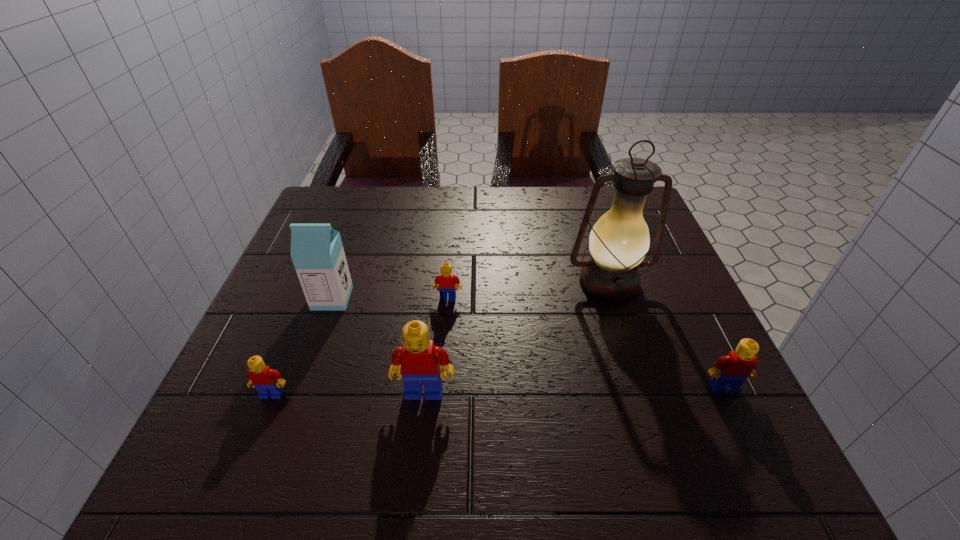
What are the coordinates of `vacant position for inserting another Lego evenly` in the screenshot? It's located at (575, 390).